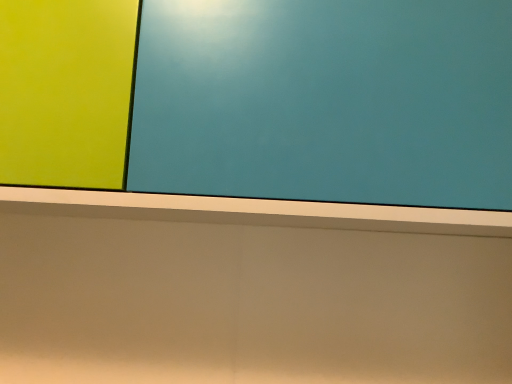
The image size is (512, 384). What are the coordinates of `matte blue window at upper right` in the screenshot? It's located at (326, 101).

What is the approximate height of matte blue window at upper right?

It is 46.54 centimeters.

In order to face matte blue window at upper right, should I rotate leftwards or rightwards?

Turn left by 1.928 degrees to look at matte blue window at upper right.

Describe the element at coordinates (326, 101) in the screenshot. I see `matte blue window at upper right` at that location.

Find the location of a particular element. This screenshot has width=512, height=384. matte blue window at upper right is located at coordinates (326, 101).